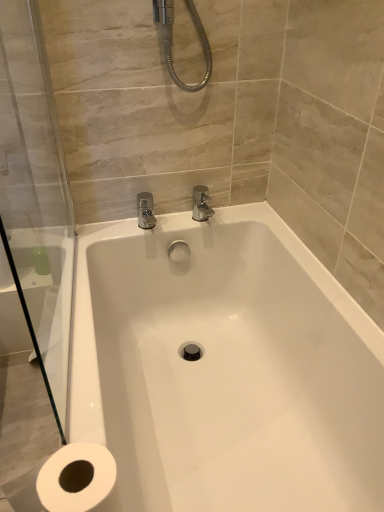
Question: From a real-world perspective, relative to transparent glass shower door at left, is white glossy bathtub at center vertically above or below?

Choices:
 (A) below
 (B) above

Answer: (A)

Question: In terms of height, does white glossy bathtub at center look taller or shorter compared to transparent glass shower door at left?

Choices:
 (A) short
 (B) tall

Answer: (A)

Question: Is point (269, 377) closer or farther from the camera than point (31, 183)?

Choices:
 (A) closer
 (B) farther

Answer: (B)

Question: Looking at their shapes, would you say transparent glass shower door at left is wider or thinner than white glossy bathtub at center?

Choices:
 (A) wide
 (B) thin

Answer: (B)

Question: From the image's perspective, is transparent glass shower door at left located above or below white glossy bathtub at center?

Choices:
 (A) above
 (B) below

Answer: (A)

Question: In the image, is transparent glass shower door at left on the left side or the right side of white glossy bathtub at center?

Choices:
 (A) right
 (B) left

Answer: (B)

Question: In terms of size, does transparent glass shower door at left appear bigger or smaller than white glossy bathtub at center?

Choices:
 (A) small
 (B) big

Answer: (A)